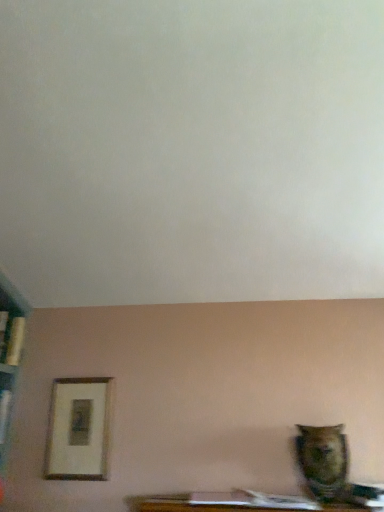
Question: From a real-world perspective, is matte brown owl at lower right above or below wooden framed print at lower left?

Choices:
 (A) below
 (B) above

Answer: (A)

Question: Would you say matte brown owl at lower right is inside or outside wooden framed print at lower left?

Choices:
 (A) outside
 (B) inside

Answer: (A)

Question: Is matte brown owl at lower right in front of or behind wooden framed print at lower left in the image?

Choices:
 (A) front
 (B) behind

Answer: (A)

Question: Considering the relative positions of wooden framed print at lower left and matte brown owl at lower right in the image provided, is wooden framed print at lower left to the left or to the right of matte brown owl at lower right?

Choices:
 (A) left
 (B) right

Answer: (A)

Question: Relative to matte brown owl at lower right, is wooden framed print at lower left in front or behind?

Choices:
 (A) front
 (B) behind

Answer: (B)

Question: Is point (84, 474) positioned closer to the camera than point (329, 448)?

Choices:
 (A) farther
 (B) closer

Answer: (A)

Question: From a real-world perspective, relative to matte brown owl at lower right, is wooden framed print at lower left vertically above or below?

Choices:
 (A) below
 (B) above

Answer: (B)